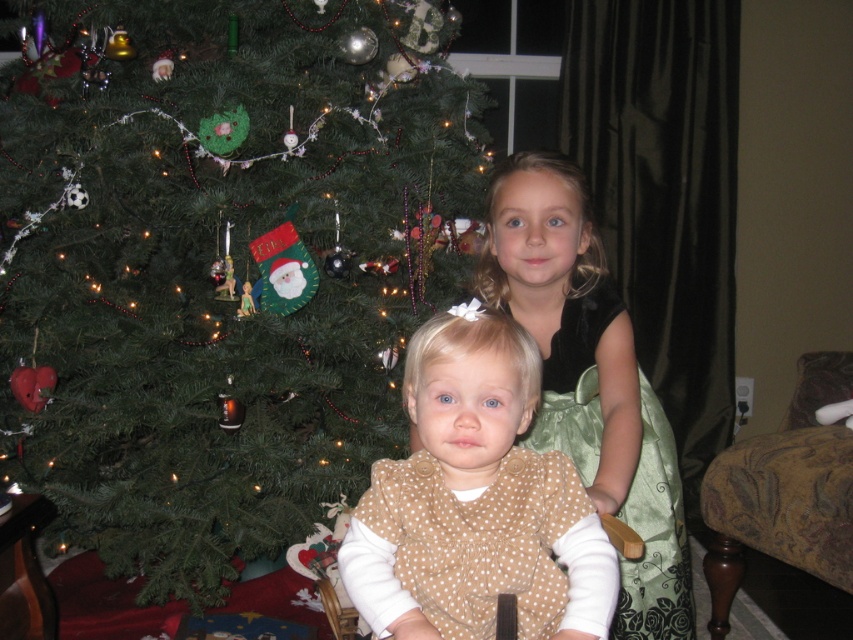
You are standing in front of the Christmas tree and want to place a new ornament exactly at the point marked as point (219, 260). What object will the ornament be placed on?

The ornament will be placed on the green matte christmas tree at center located at point (219, 260).

You are a parent trying to place a new gift under the green matte christmas tree at center. You see the patterned fabric rocking chair at lower right nearby. Based on their positions, can you tell if the rocking chair is behind or in front of the tree?

The green matte christmas tree at center is in front of the patterned fabric rocking chair at lower right, so the rocking chair is behind the tree.